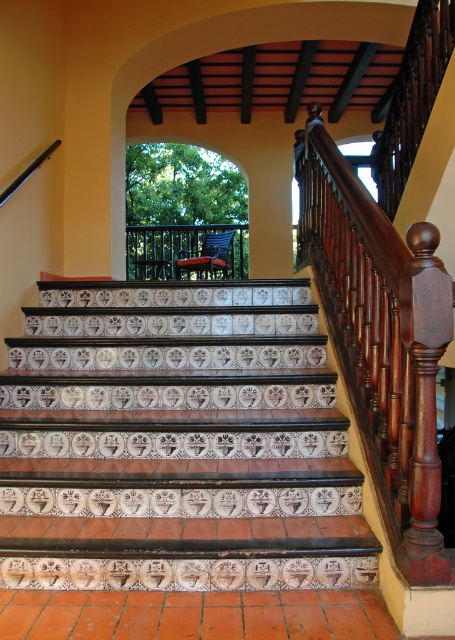
Does mahogany wood newel post at right have a greater height compared to wooden balustrade at center?

Yes, mahogany wood newel post at right is taller than wooden balustrade at center.

Can you confirm if mahogany wood newel post at right is smaller than wooden balustrade at center?

Yes.

Who is more distant from viewer, (414, 362) or (212, 252)?

The point (212, 252) is behind.

In order to click on mahogany wood newel post at right in this screenshot , I will do `click(424, 397)`.

Can you confirm if mahogany wood railing at upper right is smaller than mahogany wood newel post at right?

Incorrect, mahogany wood railing at upper right is not smaller in size than mahogany wood newel post at right.

Which is behind, point (424, 392) or point (426, 458)?

Point (424, 392)

Identify the location of mahogany wood railing at upper right. This screenshot has width=455, height=640. click(380, 339).

Between point (135, 404) and point (416, 394), which one is positioned in front?

Point (416, 394)

Does white glossy tile at center appear under mahogany wood railing at upper right?

Indeed, white glossy tile at center is positioned under mahogany wood railing at upper right.

Between point (227, 342) and point (399, 419), which one is positioned behind?

Positioned behind is point (227, 342).

You are a GUI agent. You are given a task and a screenshot of the screen. Output one action in this format:
    pyautogui.click(x=<x>, y=<y>)
    Task: Click on the white glossy tile at center
    Image resolution: width=455 pixels, height=640 pixels.
    Given the screenshot: What is the action you would take?
    pyautogui.click(x=176, y=442)